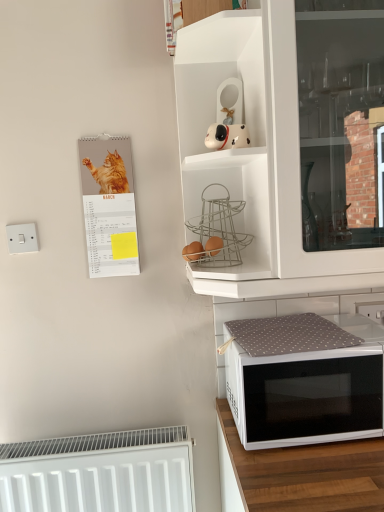
Find the location of a particular element. This screenshot has height=512, width=384. free space above white matte radiator at lower left (from a real-world perspective) is located at coordinates (89, 442).